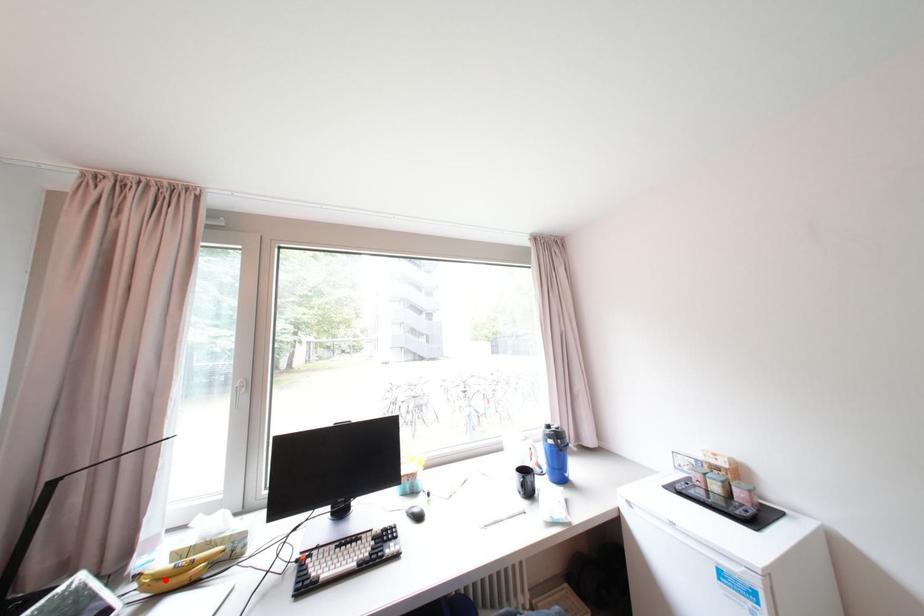
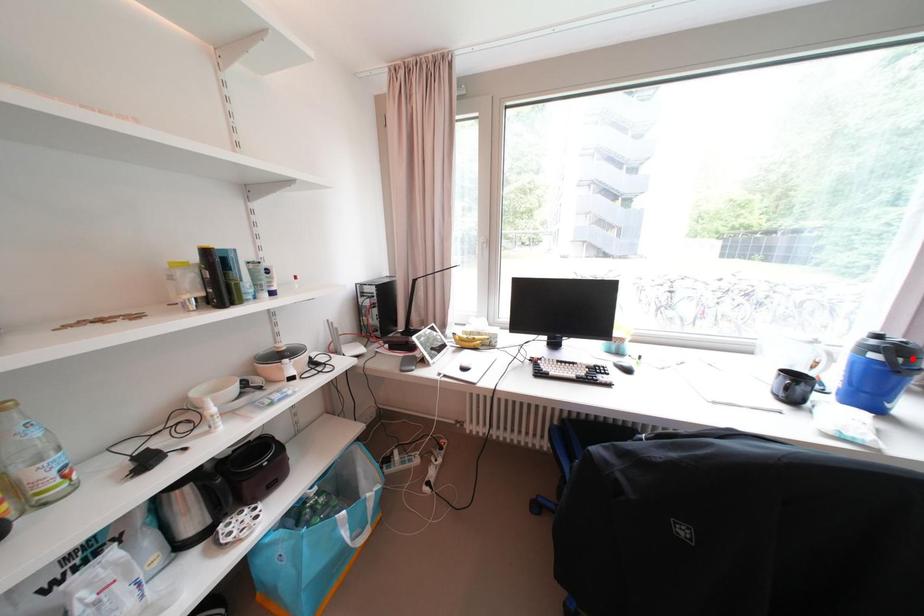
I am providing you with two images of the same scene from different viewpoints. A red point is marked on the first image and another point is marked on the second image. Are the points marked in image1 and image2 representing the same 3D position?

No